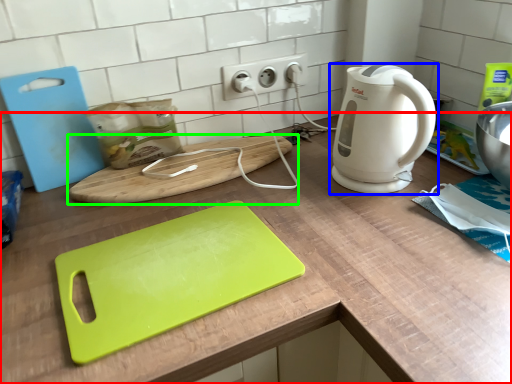
Question: Which is nearer to the counter (highlighted by a red box)? home appliance (highlighted by a blue box) or cutting board (highlighted by a green box).

Choices:
 (A) home appliance
 (B) cutting board

Answer: (B)